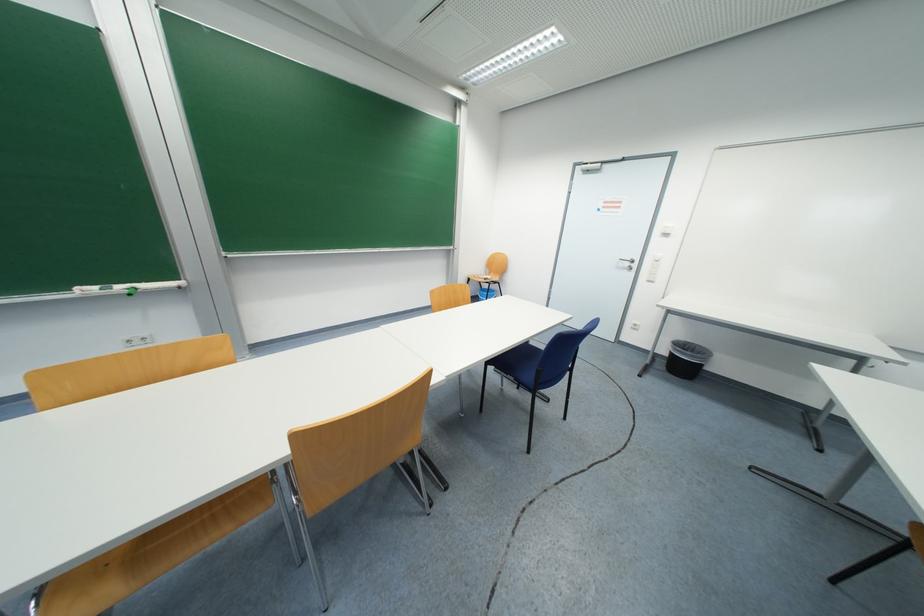
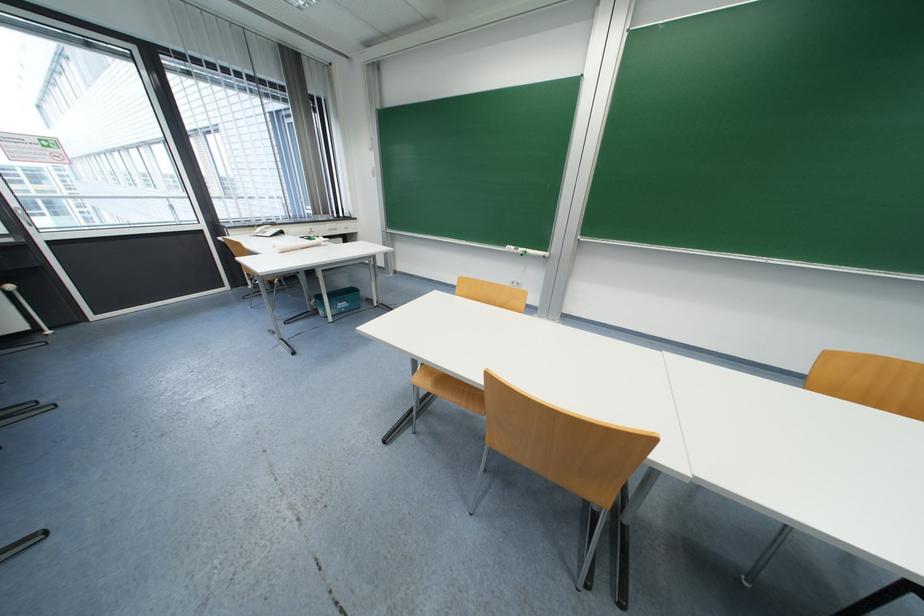
Question: How did the camera likely rotate?

Choices:
 (A) Left
 (B) Right
 (C) Up
 (D) Down

Answer: (A)